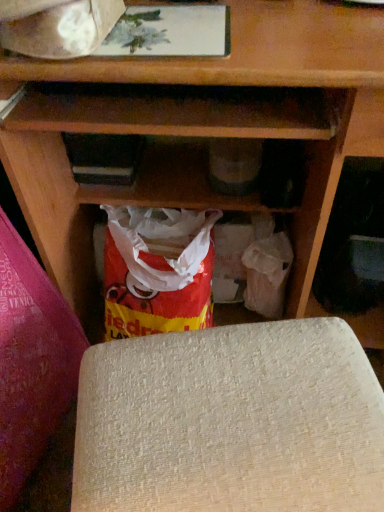
Question: Does white paper at upper left have a greater width compared to matte plastic grocery bag at lower right?

Choices:
 (A) no
 (B) yes

Answer: (B)

Question: From a real-world perspective, is white paper at upper left positioned over matte plastic grocery bag at lower right based on gravity?

Choices:
 (A) yes
 (B) no

Answer: (A)

Question: From the image's perspective, is white paper at upper left on top of matte plastic grocery bag at lower right?

Choices:
 (A) yes
 (B) no

Answer: (A)

Question: From a real-world perspective, is white paper at upper left beneath matte plastic grocery bag at lower right?

Choices:
 (A) yes
 (B) no

Answer: (B)

Question: Is white paper at upper left behind matte plastic grocery bag at lower right?

Choices:
 (A) no
 (B) yes

Answer: (A)

Question: Considering the relative sizes of white paper at upper left and matte plastic grocery bag at lower right in the image provided, is white paper at upper left shorter than matte plastic grocery bag at lower right?

Choices:
 (A) yes
 (B) no

Answer: (A)

Question: Is matte plastic grocery bag at lower right thinner than beige textured yoga mat at lower center, the first yoga mat positioned from the right?

Choices:
 (A) no
 (B) yes

Answer: (B)

Question: Does matte plastic grocery bag at lower right have a greater width compared to beige textured yoga mat at lower center, acting as the 2th yoga mat starting from the left?

Choices:
 (A) yes
 (B) no

Answer: (B)

Question: Is matte plastic grocery bag at lower right oriented towards beige textured yoga mat at lower center, the first yoga mat positioned from the right?

Choices:
 (A) no
 (B) yes

Answer: (B)

Question: Does matte plastic grocery bag at lower right have a greater height compared to beige textured yoga mat at lower center, acting as the 2th yoga mat starting from the left?

Choices:
 (A) no
 (B) yes

Answer: (A)

Question: Is matte plastic grocery bag at lower right positioned with its back to beige textured yoga mat at lower center, acting as the 2th yoga mat starting from the left?

Choices:
 (A) no
 (B) yes

Answer: (A)

Question: Does matte plastic grocery bag at lower right touch beige textured yoga mat at lower center, acting as the 2th yoga mat starting from the left?

Choices:
 (A) no
 (B) yes

Answer: (A)

Question: Is beige textured yoga mat at lower left, placed as the first yoga mat when sorted from left to right, thinner than white paper at upper left?

Choices:
 (A) no
 (B) yes

Answer: (A)